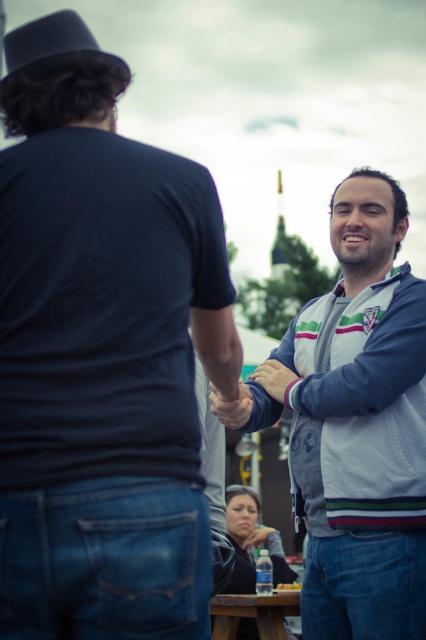
Is point (302, 438) more distant than point (241, 611)?

No, it is in front of (241, 611).

Does white striped jacket at center have a lesser width compared to brown wooden picnic table at lower center?

In fact, white striped jacket at center might be wider than brown wooden picnic table at lower center.

Find the location of a particular element. white striped jacket at center is located at coordinates (351, 420).

Who is taller, white cotton jacket at right or black felt fedora at upper left?

black felt fedora at upper left

Who is more forward, (x=29, y=627) or (x=42, y=36)?

Point (x=29, y=627) is in front.

Image resolution: width=426 pixels, height=640 pixels. Find the location of `white cotton jacket at right`. white cotton jacket at right is located at coordinates (101, 355).

Who is positioned more to the right, black felt fedora at upper left or brown wooden picnic table at lower center?

From the viewer's perspective, brown wooden picnic table at lower center appears more on the right side.

Does black felt fedora at upper left lie in front of brown wooden picnic table at lower center?

Yes, it is.

Is point (42, 67) behind point (284, 605)?

No, it is in front of (284, 605).

Image resolution: width=426 pixels, height=640 pixels. I want to click on black felt fedora at upper left, so click(54, 44).